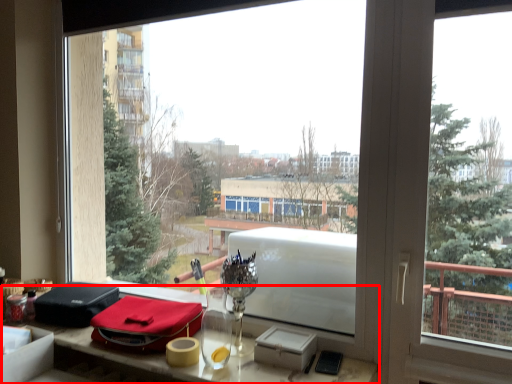
Question: From the image's perspective, considering the relative positions of table (annotated by the red box) and material in the image provided, where is table (annotated by the red box) located with respect to the staircase?

Choices:
 (A) below
 (B) above

Answer: (A)